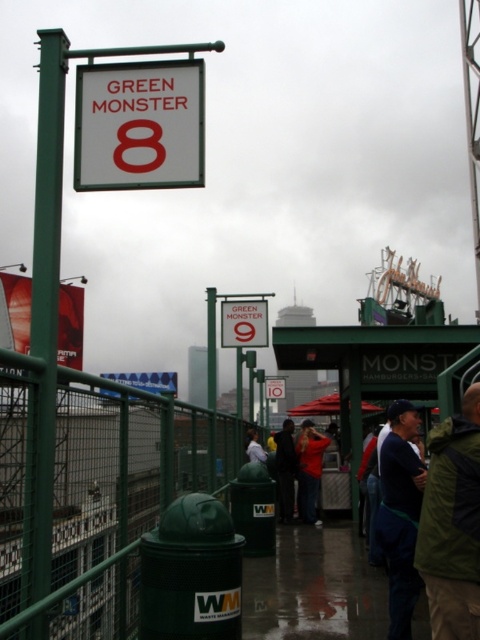
Does green metal fence at lower left appear over dark fabric coat at center?

Indeed, green metal fence at lower left is positioned over dark fabric coat at center.

Does green metal fence at lower left have a smaller size compared to dark fabric coat at center?

No.

I want to click on green metal fence at lower left, so click(x=98, y=490).

Does point (298, 481) lie in front of point (275, 461)?

Yes, it is.

Does red jacket at center lie in front of dark fabric coat at center?

That is True.

This screenshot has height=640, width=480. In order to click on red jacket at center in this screenshot , I will do click(310, 470).

Identify the location of red jacket at center. (310, 470).

Between point (311, 460) and point (252, 429), which one is positioned in front?

Point (311, 460) is more forward.

Does red jacket at center have a lesser height compared to dark blue jacket at center?

No, red jacket at center is not shorter than dark blue jacket at center.

Who is more distant from viewer, [300,504] or [252,451]?

Point [252,451]

In order to click on red jacket at center in this screenshot , I will do `click(310, 470)`.